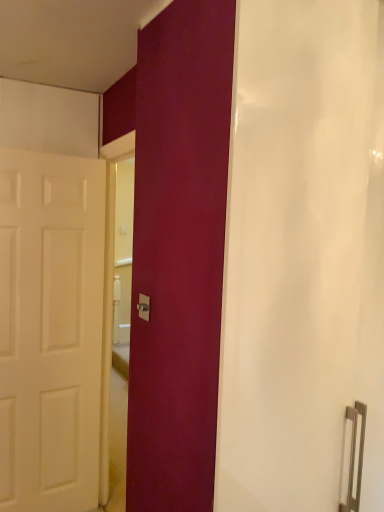
Question: Can you confirm if matte white shower curtain at center is bigger than matte silver switch at center?

Choices:
 (A) yes
 (B) no

Answer: (A)

Question: Is matte white shower curtain at center turned away from matte silver switch at center?

Choices:
 (A) no
 (B) yes

Answer: (A)

Question: Is matte white shower curtain at center closer to the viewer compared to matte silver switch at center?

Choices:
 (A) no
 (B) yes

Answer: (B)

Question: From a real-world perspective, is matte white shower curtain at center under matte silver switch at center?

Choices:
 (A) yes
 (B) no

Answer: (A)

Question: Are matte white shower curtain at center and matte silver switch at center far apart?

Choices:
 (A) no
 (B) yes

Answer: (A)

Question: Considering the relative positions of matte white shower curtain at center and matte silver switch at center in the image provided, is matte white shower curtain at center to the right of matte silver switch at center from the viewer's perspective?

Choices:
 (A) no
 (B) yes

Answer: (B)

Question: Is matte silver switch at center shorter than matte white shower curtain at center?

Choices:
 (A) yes
 (B) no

Answer: (A)

Question: Is matte silver switch at center thinner than matte white shower curtain at center?

Choices:
 (A) no
 (B) yes

Answer: (B)

Question: Is matte silver switch at center at the right side of matte white shower curtain at center?

Choices:
 (A) yes
 (B) no

Answer: (B)

Question: Is matte white shower curtain at center located within matte silver switch at center?

Choices:
 (A) yes
 (B) no

Answer: (B)

Question: From a real-world perspective, is matte silver switch at center located beneath matte white shower curtain at center?

Choices:
 (A) no
 (B) yes

Answer: (A)

Question: Is matte silver switch at center taller than matte white shower curtain at center?

Choices:
 (A) no
 (B) yes

Answer: (A)

Question: Could you tell me if white matte door at left is facing matte silver switch at center?

Choices:
 (A) no
 (B) yes

Answer: (B)